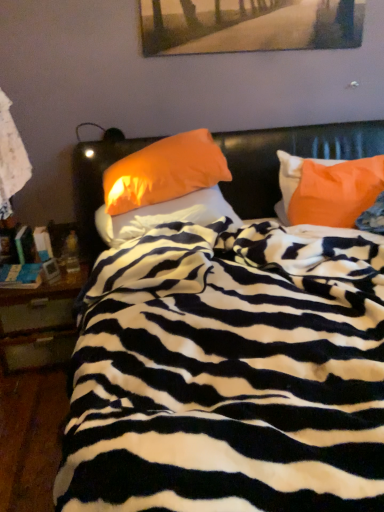
This screenshot has width=384, height=512. What do you see at coordinates (164, 172) in the screenshot? I see `orange fabric pillow at center, the 2th pillow in the right-to-left sequence` at bounding box center [164, 172].

Describe the element at coordinates (228, 374) in the screenshot. Image resolution: width=384 pixels, height=512 pixels. I see `zebra-patterned blanket at center` at that location.

How much space does orange fabric pillow at center, marked as the 3th pillow in a right-to-left arrangement, occupy horizontally?

orange fabric pillow at center, marked as the 3th pillow in a right-to-left arrangement, is 18.77 inches wide.

This screenshot has height=512, width=384. Find the location of `orange fabric pillow at center, the 2th pillow in the right-to-left sequence`. orange fabric pillow at center, the 2th pillow in the right-to-left sequence is located at coordinates (164, 172).

Is orange fabric pillow at upper right, the first pillow from the right, in contact with wooden nightstand at left?

No, orange fabric pillow at upper right, the first pillow from the right, is not in contact with wooden nightstand at left.

Is orange fabric pillow at upper right, which appears as the third pillow when viewed from the left, oriented towards wooden nightstand at left?

No, orange fabric pillow at upper right, which appears as the third pillow when viewed from the left, is not oriented towards wooden nightstand at left.

Does orange fabric pillow at upper right, the first pillow from the right, have a lesser height compared to wooden nightstand at left?

Correct, orange fabric pillow at upper right, the first pillow from the right, is not as tall as wooden nightstand at left.

Is orange fabric pillow at center, the 1th pillow when ordered from left to right, at the back of zebra-patterned blanket at center?

Yes, zebra-patterned blanket at center is positioned with its back facing orange fabric pillow at center, the 1th pillow when ordered from left to right.

From a real-world perspective, relative to orange fabric pillow at center, marked as the 3th pillow in a right-to-left arrangement, is zebra-patterned blanket at center vertically above or below?

zebra-patterned blanket at center is situated lower than orange fabric pillow at center, marked as the 3th pillow in a right-to-left arrangement, in the real world.

Which point is more distant from viewer, (283, 400) or (99, 212)?

Positioned behind is point (99, 212).

Can you tell me how much orange fabric pillow at center, marked as the 3th pillow in a right-to-left arrangement, and wooden painting at upper center differ in facing direction?

0.467 degrees separate the facing orientations of orange fabric pillow at center, marked as the 3th pillow in a right-to-left arrangement, and wooden painting at upper center.

Is orange fabric pillow at center, the 1th pillow when ordered from left to right, bigger or smaller than wooden painting at upper center?

orange fabric pillow at center, the 1th pillow when ordered from left to right, is bigger than wooden painting at upper center.

From the image's perspective, who appears lower, orange fabric pillow at center, marked as the 3th pillow in a right-to-left arrangement, or wooden painting at upper center?

orange fabric pillow at center, marked as the 3th pillow in a right-to-left arrangement.

Is orange fabric pillow at center, marked as the 3th pillow in a right-to-left arrangement, far from wooden painting at upper center?

No, orange fabric pillow at center, marked as the 3th pillow in a right-to-left arrangement, is not far from wooden painting at upper center.

Which object is closer to the camera taking this photo, wooden nightstand at left or wooden painting at upper center?

Positioned in front is wooden nightstand at left.

Is point (10, 318) closer or farther from the camera than point (302, 32)?

Point (10, 318) appears to be closer to the viewer than point (302, 32).

Which of these two, wooden nightstand at left or wooden painting at upper center, stands shorter?

wooden painting at upper center is shorter.

From the image's perspective, which one is positioned lower, wooden nightstand at left or wooden painting at upper center?

wooden nightstand at left.

From a real-world perspective, does wooden painting at upper center sit lower than orange fabric pillow at center, which appears as the 2th pillow when viewed from the left?

Actually, wooden painting at upper center is physically above orange fabric pillow at center, which appears as the 2th pillow when viewed from the left, in the real world.

From the image's perspective, which object appears higher, wooden painting at upper center or orange fabric pillow at center, the 2th pillow in the right-to-left sequence?

wooden painting at upper center, from the image's perspective.

Is wooden painting at upper center positioned before orange fabric pillow at center, the 2th pillow in the right-to-left sequence?

No, wooden painting at upper center is behind orange fabric pillow at center, the 2th pillow in the right-to-left sequence.

Does wooden painting at upper center have a greater width compared to orange fabric pillow at center, the 2th pillow in the right-to-left sequence?

No.

Does zebra-patterned blanket at center have a greater height compared to orange fabric pillow at upper right, the first pillow from the right?

Correct, zebra-patterned blanket at center is much taller as orange fabric pillow at upper right, the first pillow from the right.

Is zebra-patterned blanket at center far away from orange fabric pillow at upper right, the first pillow from the right?

No.

Does zebra-patterned blanket at center have a greater width compared to orange fabric pillow at upper right, the first pillow from the right?

Yes, zebra-patterned blanket at center is wider than orange fabric pillow at upper right, the first pillow from the right.

Which of these two, zebra-patterned blanket at center or orange fabric pillow at upper right, the first pillow from the right, is bigger?

zebra-patterned blanket at center.

From a real-world perspective, is orange fabric pillow at center, the 1th pillow when ordered from left to right, on top of orange fabric pillow at center, which appears as the 2th pillow when viewed from the left?

No, from a real-world perspective, orange fabric pillow at center, the 1th pillow when ordered from left to right, is not on top of orange fabric pillow at center, which appears as the 2th pillow when viewed from the left.

Is point (161, 203) positioned before point (135, 168)?

No.

Considering the relative sizes of orange fabric pillow at center, the 1th pillow when ordered from left to right, and orange fabric pillow at center, the 2th pillow in the right-to-left sequence, in the image provided, is orange fabric pillow at center, the 1th pillow when ordered from left to right, smaller than orange fabric pillow at center, the 2th pillow in the right-to-left sequence,?

Yes.

This screenshot has height=512, width=384. In order to click on nightstand behind the orange fabric pillow at upper right, the first pillow from the right in this screenshot , I will do `click(39, 323)`.

At what (x,y) coordinates should I click in order to perform the action: click on bed below the orange fabric pillow at center, the 1th pillow when ordered from left to right (from the image's perspective). Please return your answer as a coordinate pair (x, y). This screenshot has width=384, height=512. Looking at the image, I should click on (228, 374).

Estimate the real-world distances between objects in this image. Which object is further from orange fabric pillow at upper right, which appears as the third pillow when viewed from the left, zebra-patterned blanket at center or wooden painting at upper center?

wooden painting at upper center lies further to orange fabric pillow at upper right, which appears as the third pillow when viewed from the left, than the other object.

When comparing their distances from orange fabric pillow at upper right, the first pillow from the right, does wooden nightstand at left or orange fabric pillow at center, marked as the 3th pillow in a right-to-left arrangement, seem closer?

orange fabric pillow at center, marked as the 3th pillow in a right-to-left arrangement.

From the image, which object appears to be nearer to wooden painting at upper center, orange fabric pillow at center, the 2th pillow in the right-to-left sequence, or zebra-patterned blanket at center?

orange fabric pillow at center, the 2th pillow in the right-to-left sequence, is positioned closer to the anchor wooden painting at upper center.

When comparing their distances from wooden nightstand at left, does orange fabric pillow at center, marked as the 3th pillow in a right-to-left arrangement, or orange fabric pillow at center, which appears as the 2th pillow when viewed from the left, seem closer?

Based on the image, orange fabric pillow at center, marked as the 3th pillow in a right-to-left arrangement, appears to be nearer to wooden nightstand at left.

Estimate the real-world distances between objects in this image. Which object is further from orange fabric pillow at upper right, the first pillow from the right, zebra-patterned blanket at center or orange fabric pillow at center, which appears as the 2th pillow when viewed from the left?

zebra-patterned blanket at center is positioned further to the anchor orange fabric pillow at upper right, the first pillow from the right.

Which object lies further to the anchor point orange fabric pillow at upper right, the first pillow from the right, orange fabric pillow at center, which appears as the 2th pillow when viewed from the left, or orange fabric pillow at center, marked as the 3th pillow in a right-to-left arrangement?

orange fabric pillow at center, which appears as the 2th pillow when viewed from the left, is further to orange fabric pillow at upper right, the first pillow from the right.

When comparing their distances from orange fabric pillow at center, the 1th pillow when ordered from left to right, does wooden painting at upper center or wooden nightstand at left seem closer?

The object closer to orange fabric pillow at center, the 1th pillow when ordered from left to right, is wooden nightstand at left.

Looking at the image, which one is located further to wooden painting at upper center, orange fabric pillow at center, marked as the 3th pillow in a right-to-left arrangement, or zebra-patterned blanket at center?

zebra-patterned blanket at center lies further to wooden painting at upper center than the other object.

In order to click on nightstand between zebra-patterned blanket at center and wooden painting at upper center along the z-axis in this screenshot , I will do `click(39, 323)`.

The image size is (384, 512). In order to click on pillow that lies between wooden painting at upper center and orange fabric pillow at upper right, which appears as the third pillow when viewed from the left, from top to bottom in this screenshot , I will do (x=164, y=172).

Where is `picture frame between wooden nightstand at left and orange fabric pillow at upper right, the first pillow from the right`? The image size is (384, 512). picture frame between wooden nightstand at left and orange fabric pillow at upper right, the first pillow from the right is located at coordinates (249, 25).

Image resolution: width=384 pixels, height=512 pixels. Find the location of `pillow situated between orange fabric pillow at center, marked as the 3th pillow in a right-to-left arrangement, and orange fabric pillow at upper right, which appears as the third pillow when viewed from the left, from left to right`. pillow situated between orange fabric pillow at center, marked as the 3th pillow in a right-to-left arrangement, and orange fabric pillow at upper right, which appears as the third pillow when viewed from the left, from left to right is located at coordinates (164, 172).